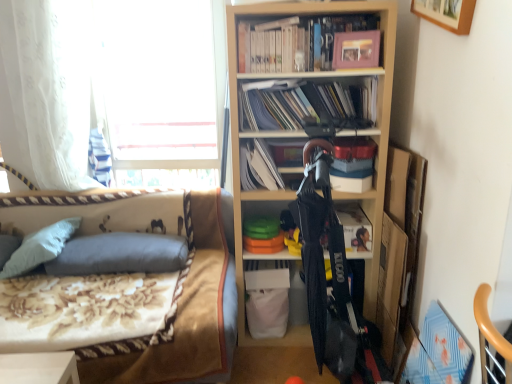
At what (x,y) coordinates should I click in order to perform the action: click on matte black book at center, acting as the fourth book starting from the top. Please return your answer as a coordinate pair (x, y). Looking at the image, I should click on (355, 228).

This screenshot has width=512, height=384. What do you see at coordinates (120, 254) in the screenshot?
I see `gray fabric pillow at left, the 2th pillow from the left` at bounding box center [120, 254].

Measure the distance between matte paper files at center, the 2th book positioned from the top, and camera.

1.88 meters.

Locate an element on the screen. floral fabric bed at left is located at coordinates (183, 283).

Locate an element on the screen. white sheer curtain at left is located at coordinates (46, 92).

Where is `wooden picture frame at upper right, which ranks as the second picture frame in back-to-front order`? wooden picture frame at upper right, which ranks as the second picture frame in back-to-front order is located at coordinates (446, 13).

This screenshot has height=384, width=512. Identify the location of pink matte picture frame at upper center, which is counted as the 2th picture frame, starting from the front. (x=356, y=49).

Which of these two, pink matte picture frame at upper center, the first picture frame viewed from the back, or white sheer curtain at left, is bigger?

white sheer curtain at left.

How far apart are pink matte picture frame at upper center, the first picture frame viewed from the back, and white sheer curtain at left?

pink matte picture frame at upper center, the first picture frame viewed from the back, is 4.86 feet from white sheer curtain at left.

Looking at their sizes, would you say pink matte picture frame at upper center, which is counted as the 2th picture frame, starting from the front, is wider or thinner than white sheer curtain at left?

In the image, pink matte picture frame at upper center, which is counted as the 2th picture frame, starting from the front, appears to be more narrow than white sheer curtain at left.

How different are the orientations of pink matte picture frame at upper center, the first picture frame viewed from the back, and white sheer curtain at left in degrees?

21.4 degrees.

How different are the orientations of gray fabric pillow at left, which ranks as the 2th pillow in right-to-left order, and pink matte picture frame at upper center, which is counted as the 2th picture frame, starting from the front, in degrees?

The angle between the facing direction of gray fabric pillow at left, which ranks as the 2th pillow in right-to-left order, and the facing direction of pink matte picture frame at upper center, which is counted as the 2th picture frame, starting from the front, is 23.2 degrees.

From a real-world perspective, between gray fabric pillow at left, which ranks as the 1th pillow in left-to-right order, and pink matte picture frame at upper center, arranged as the second picture frame when viewed from the right, who is vertically higher?

From a 3D spatial view, pink matte picture frame at upper center, arranged as the second picture frame when viewed from the right, is above.

From the gray fabric pillow at left, which ranks as the 1th pillow in left-to-right order, count 1st picture frames forward and point to it. Please provide its 2D coordinates.

[(356, 49)]

Does gray fabric pillow at left, which ranks as the 2th pillow in right-to-left order, have a lesser height compared to pink matte picture frame at upper center, the first picture frame viewed from the back?

Incorrect, the height of gray fabric pillow at left, which ranks as the 2th pillow in right-to-left order, does not fall short of that of pink matte picture frame at upper center, the first picture frame viewed from the back.

Is floral fabric bed at left at the right side of pink matte picture frame at upper center, the first picture frame viewed from the back?

No, floral fabric bed at left is not to the right of pink matte picture frame at upper center, the first picture frame viewed from the back.

Is pink matte picture frame at upper center, which is counted as the 2th picture frame, starting from the front, at the back of floral fabric bed at left?

floral fabric bed at left is not turned away from pink matte picture frame at upper center, which is counted as the 2th picture frame, starting from the front.

In terms of height, does floral fabric bed at left look taller or shorter compared to pink matte picture frame at upper center, the first picture frame viewed from the back?

Clearly, floral fabric bed at left is taller compared to pink matte picture frame at upper center, the first picture frame viewed from the back.

Based on the photo, from a real-world perspective, is matte paper files at center, which appears as the third book when ordered from the bottom, physically located above or below wooden bookshelf at center?

From a real-world perspective, matte paper files at center, which appears as the third book when ordered from the bottom, is physically above wooden bookshelf at center.

Based on the photo, considering the relative sizes of matte paper files at center, the 2th book positioned from the top, and wooden bookshelf at center in the image provided, is matte paper files at center, the 2th book positioned from the top, shorter than wooden bookshelf at center?

Yes, matte paper files at center, the 2th book positioned from the top, is shorter than wooden bookshelf at center.

Looking at this image, considering the sizes of objects matte paper files at center, which appears as the third book when ordered from the bottom, and wooden bookshelf at center in the image provided, who is wider, matte paper files at center, which appears as the third book when ordered from the bottom, or wooden bookshelf at center?

With larger width is wooden bookshelf at center.

Based on their sizes in the image, would you say matte paper files at center, which appears as the third book when ordered from the bottom, is bigger or smaller than wooden bookshelf at center?

Considering their sizes, matte paper files at center, which appears as the third book when ordered from the bottom, takes up less space than wooden bookshelf at center.

In order to click on bookcase in front of the gray fabric pillow at left, which ranks as the 2th pillow in right-to-left order in this screenshot , I will do `click(305, 137)`.

Considering the sizes of objects gray fabric pillow at left, which ranks as the 2th pillow in right-to-left order, and wooden bookshelf at center in the image provided, who is wider, gray fabric pillow at left, which ranks as the 2th pillow in right-to-left order, or wooden bookshelf at center?

wooden bookshelf at center.

Is gray fabric pillow at left, which ranks as the 1th pillow in left-to-right order, bigger than wooden bookshelf at center?

Actually, gray fabric pillow at left, which ranks as the 1th pillow in left-to-right order, might be smaller than wooden bookshelf at center.

From a real-world perspective, which object stands above the other?

wooden bookshelf at center.

From a real-world perspective, who is located lower, gray fabric pillow at left, the 1th pillow in the right-to-left sequence, or pink matte picture frame at upper center, which is counted as the first picture frame, starting from the left?

From a 3D spatial view, gray fabric pillow at left, the 1th pillow in the right-to-left sequence, is below.

Considering the sizes of objects gray fabric pillow at left, the 2th pillow from the left, and pink matte picture frame at upper center, the first picture frame viewed from the back, in the image provided, who is thinner, gray fabric pillow at left, the 2th pillow from the left, or pink matte picture frame at upper center, the first picture frame viewed from the back,?

pink matte picture frame at upper center, the first picture frame viewed from the back, is thinner.

How far apart are gray fabric pillow at left, the 1th pillow in the right-to-left sequence, and pink matte picture frame at upper center, which is counted as the 2th picture frame, starting from the front?

gray fabric pillow at left, the 1th pillow in the right-to-left sequence, and pink matte picture frame at upper center, which is counted as the 2th picture frame, starting from the front, are 4.51 feet apart.

Which object is further away from the camera taking this photo, gray fabric pillow at left, the 2th pillow from the left, or pink matte picture frame at upper center, arranged as the second picture frame when viewed from the right?

gray fabric pillow at left, the 2th pillow from the left, is further away from the camera.

Is floral fabric bed at left completely or partially inside gray fabric pillow at left, the 2th pillow from the left?

No, floral fabric bed at left is not surrounded by gray fabric pillow at left, the 2th pillow from the left.

Is gray fabric pillow at left, the 2th pillow from the left, in front of floral fabric bed at left?

No, gray fabric pillow at left, the 2th pillow from the left, is further to the viewer.

Where is `bed that appears on the left of gray fabric pillow at left, the 2th pillow from the left`? The width and height of the screenshot is (512, 384). bed that appears on the left of gray fabric pillow at left, the 2th pillow from the left is located at coordinates (183, 283).

Is gray fabric pillow at left, the 1th pillow in the right-to-left sequence, shorter than floral fabric bed at left?

Yes, gray fabric pillow at left, the 1th pillow in the right-to-left sequence, is shorter than floral fabric bed at left.

Identify the location of the 1st picture frame to the right of the white sheer curtain at left, starting your count from the anchor. (356, 49).

Where is `pillow that is the 1st one when counting downward from the pink matte picture frame at upper center, the first picture frame viewed from the back (from the image's perspective)`? pillow that is the 1st one when counting downward from the pink matte picture frame at upper center, the first picture frame viewed from the back (from the image's perspective) is located at coordinates (40, 247).

Estimate the real-world distances between objects in this image. Which object is further from gray fabric pillow at left, which ranks as the 2th pillow in right-to-left order, white sheer curtain at left or gray fabric pillow at left, the 1th pillow in the right-to-left sequence?

white sheer curtain at left.

From the image, which object appears to be farther from wooden picture frame at upper right, which ranks as the second picture frame in back-to-front order, white paper at center, which ranks as the 2th book in bottom-to-top order, or gray fabric pillow at left, the 2th pillow from the left?

gray fabric pillow at left, the 2th pillow from the left, is further to wooden picture frame at upper right, which ranks as the second picture frame in back-to-front order.

Consider the image. Looking at the image, which one is located further to wooden picture frame at upper right, marked as the second picture frame in a left-to-right arrangement, white sheer curtain at left or white paper at center, the third book in the top-to-bottom sequence?

Among the two, white sheer curtain at left is located further to wooden picture frame at upper right, marked as the second picture frame in a left-to-right arrangement.

Which object lies further to the anchor point matte black book at center, acting as the fourth book starting from the top, floral fabric bed at left or matte pink photo album at upper center, positioned as the 4th book in bottom-to-top order?

The object further to matte black book at center, acting as the fourth book starting from the top, is floral fabric bed at left.

Estimate the real-world distances between objects in this image. Which object is further from white paper at center, which ranks as the 2th book in bottom-to-top order, wooden picture frame at upper right, the 1th picture frame when ordered from front to back, or gray fabric pillow at left, the 1th pillow in the right-to-left sequence?

wooden picture frame at upper right, the 1th picture frame when ordered from front to back, lies further to white paper at center, which ranks as the 2th book in bottom-to-top order, than the other object.

Looking at the image, which one is located closer to floral fabric bed at left, matte black book at center, acting as the fourth book starting from the top, or gray fabric pillow at left, which ranks as the 1th pillow in left-to-right order?

gray fabric pillow at left, which ranks as the 1th pillow in left-to-right order.

Based on their spatial positions, is wooden picture frame at upper right, the 1th picture frame when ordered from front to back, or floral fabric bed at left closer to gray fabric pillow at left, the 2th pillow from the left?

floral fabric bed at left is closer to gray fabric pillow at left, the 2th pillow from the left.

From the image, which object appears to be nearer to matte black book at center, acting as the fourth book starting from the top, white paper at center, the third book in the top-to-bottom sequence, or gray fabric pillow at left, the 1th pillow in the right-to-left sequence?

white paper at center, the third book in the top-to-bottom sequence, is positioned closer to the anchor matte black book at center, acting as the fourth book starting from the top.

This screenshot has width=512, height=384. Find the location of `pillow between floral fabric bed at left and matte black book at center, which ranks as the 1th book in bottom-to-top order, from left to right`. pillow between floral fabric bed at left and matte black book at center, which ranks as the 1th book in bottom-to-top order, from left to right is located at coordinates (120, 254).

The width and height of the screenshot is (512, 384). I want to click on pillow located between white sheer curtain at left and white paper at center, which ranks as the 2th book in bottom-to-top order, in the left-right direction, so click(x=120, y=254).

Identify the location of picture frame between wooden picture frame at upper right, marked as the 1th picture frame in a right-to-left arrangement, and matte paper files at center, which appears as the third book when ordered from the bottom, along the z-axis. Image resolution: width=512 pixels, height=384 pixels. (356, 49).

You are a GUI agent. You are given a task and a screenshot of the screen. Output one action in this format:
    pyautogui.click(x=<x>, y=<y>)
    Task: Click on the bookcase that lies between matte pink photo album at upper center, marked as the first book in a top-to-bottom arrangement, and matte black book at center, acting as the fourth book starting from the top, from top to bottom
    The width and height of the screenshot is (512, 384).
    Given the screenshot: What is the action you would take?
    tap(305, 137)